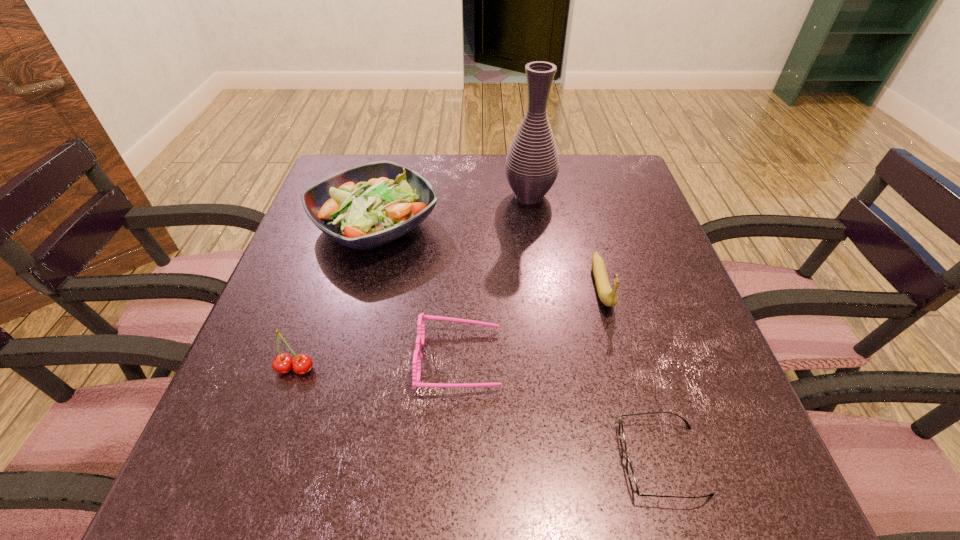
Image resolution: width=960 pixels, height=540 pixels. Identify the location of the fourth object from left to right. (532, 164).

The width and height of the screenshot is (960, 540). In order to click on the tallest object in this screenshot , I will do `click(532, 164)`.

The width and height of the screenshot is (960, 540). Identify the location of salad plate. (368, 205).

Identify the location of banana. The height and width of the screenshot is (540, 960). (608, 297).

This screenshot has height=540, width=960. Find the location of `cherry`. cherry is located at coordinates (283, 363).

Image resolution: width=960 pixels, height=540 pixels. What are the coordinates of `the second shortest object` in the screenshot? It's located at (417, 357).

The image size is (960, 540). Find the location of `the left spectacles`. the left spectacles is located at coordinates click(x=417, y=357).

The height and width of the screenshot is (540, 960). Find the location of `the nearer spectacles`. the nearer spectacles is located at coordinates [630, 472].

The width and height of the screenshot is (960, 540). Identify the location of the nearest object. (630, 472).

Locate an element on the screen. This screenshot has height=540, width=960. free location located 0.110m on the front of the vase is located at coordinates pos(535,239).